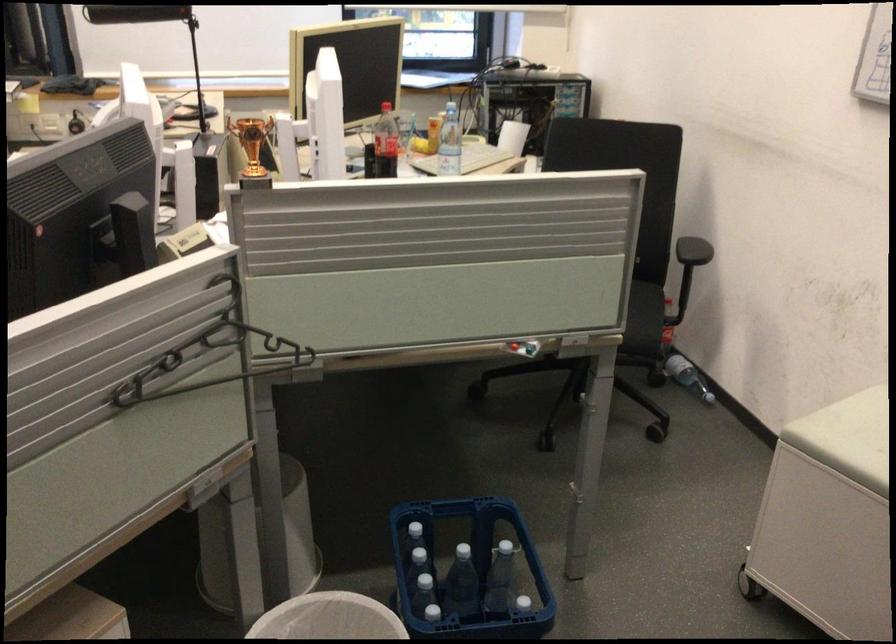
This screenshot has width=896, height=644. I want to click on white trash can, so click(329, 619).